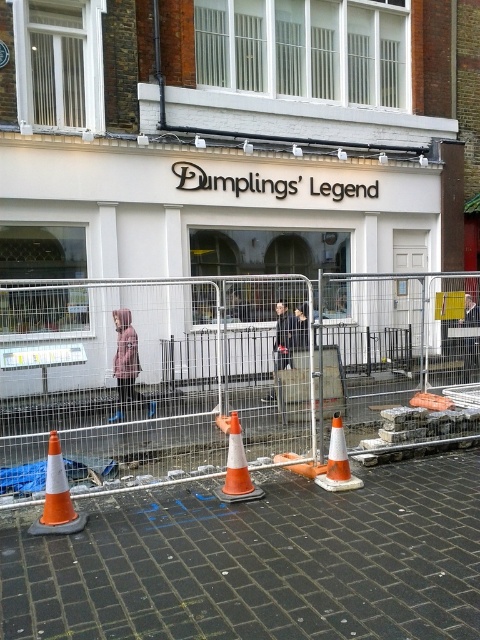
Question: From the image, what is the correct spatial relationship of white matte sign at center in relation to orange/white traffic cone at lower center?

Choices:
 (A) below
 (B) above

Answer: (B)

Question: Which object is the closest to the white matte sign at center?

Choices:
 (A) metal fence at center
 (B) orange/white traffic cone at lower center

Answer: (A)

Question: Which is farther from the orange plastic traffic cone at lower left?

Choices:
 (A) orange/white traffic cone at lower center
 (B) orange matte traffic cone at center

Answer: (A)

Question: Among these objects, which one is nearest to the camera?

Choices:
 (A) orange/white traffic cone at lower center
 (B) black brick pavement at lower center
 (C) orange matte traffic cone at center

Answer: (B)

Question: Does black brick pavement at lower center appear under orange plastic traffic cone at lower left?

Choices:
 (A) no
 (B) yes

Answer: (B)

Question: Can you confirm if white matte sign at center is positioned below orange plastic traffic cone at lower left?

Choices:
 (A) no
 (B) yes

Answer: (A)